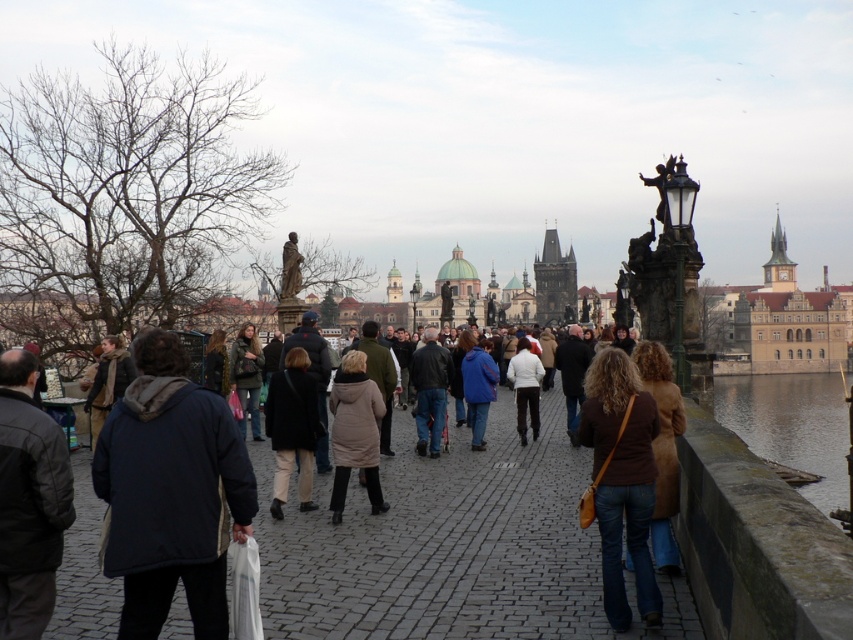
Can you confirm if dark blue jacket at left is wider than smooth concrete wall at lower right?

No, dark blue jacket at left is not wider than smooth concrete wall at lower right.

Does dark blue jacket at left appear over smooth concrete wall at lower right?

Yes.

Who is more distant from viewer, (111, 573) or (752, 426)?

The point (752, 426) is more distant.

I want to click on dark blue jacket at left, so click(x=171, y=492).

Is point (155, 554) positioned before point (466, 378)?

Yes, point (155, 554) is in front of point (466, 378).

Is point (138, 506) closer to viewer compared to point (468, 340)?

Yes.

This screenshot has width=853, height=640. I want to click on dark blue jacket at left, so click(171, 492).

Is brown leather jacket at center in front of matte black coat at center?

Yes, brown leather jacket at center is closer to the viewer.

Describe the element at coordinates (621, 481) in the screenshot. Image resolution: width=853 pixels, height=640 pixels. I see `brown leather jacket at center` at that location.

Who is more distant from viewer, (613,349) or (268,422)?

The point (268,422) is more distant.

This screenshot has height=640, width=853. I want to click on brown leather jacket at center, so click(x=621, y=481).